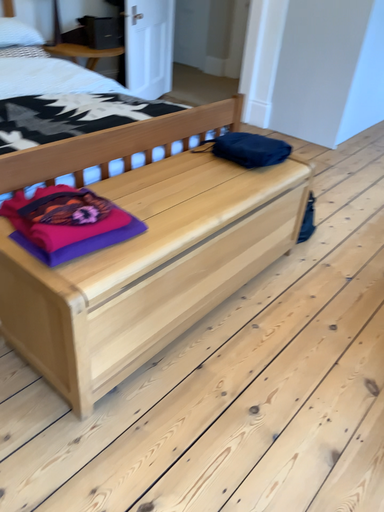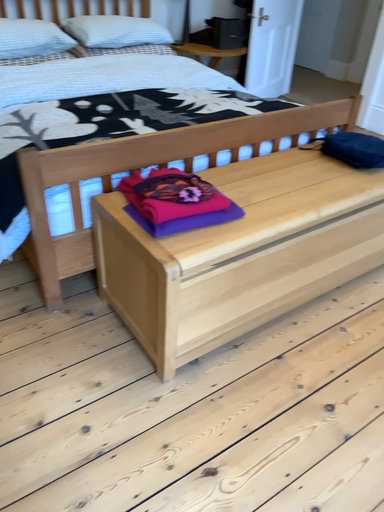
Question: Which way did the camera rotate in the video?

Choices:
 (A) rotated left
 (B) rotated right

Answer: (A)